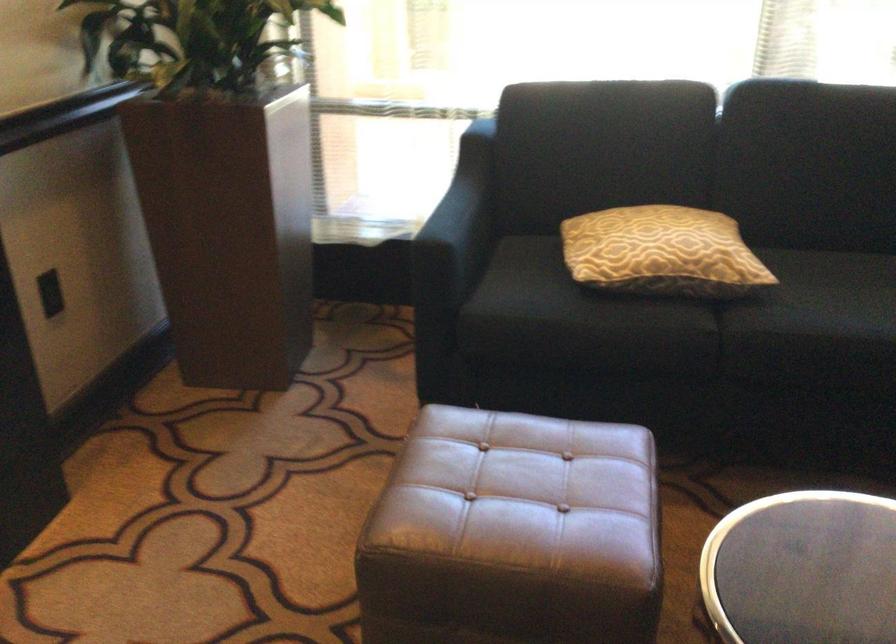
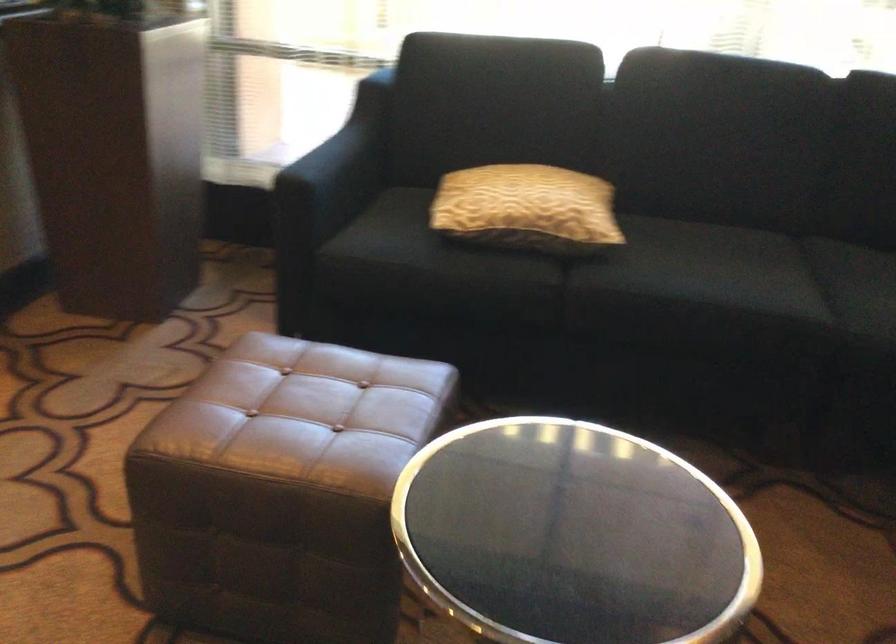
Question: What movement of the cameraman would produce the second image?

Choices:
 (A) Left
 (B) Right
 (C) Forward
 (D) Backward

Answer: (B)